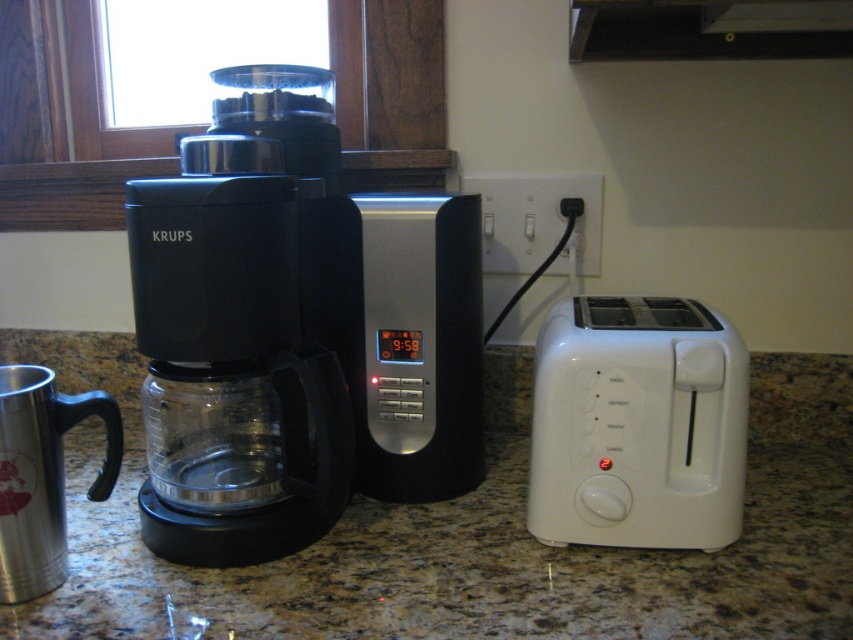
You are organizing the kitchen and want to place a new spice jar between the black plastic coffee maker at center and the white plastic toaster at right. According to the scene description, which appliance should the spice jar be placed closer to?

The black plastic coffee maker at center is positioned over the white plastic toaster at right, so the spice jar should be placed closer to the white plastic toaster at right since it is located below the coffee maker.